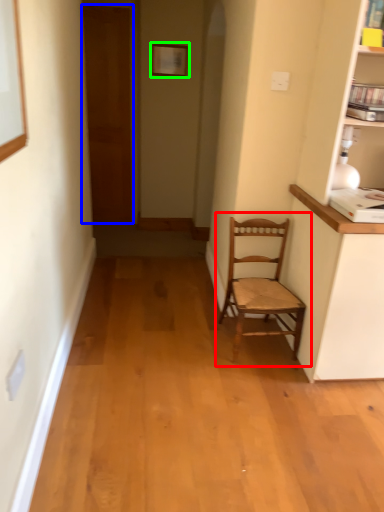
Question: Which is farther away from chair (highlighted by a red box)? door (highlighted by a blue box) or picture frame (highlighted by a green box)?

Choices:
 (A) door
 (B) picture frame

Answer: (A)